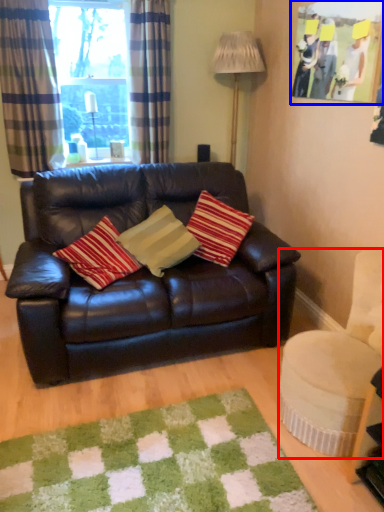
Question: Among these objects, which one is nearest to the camera, swivel chair (highlighted by a red box) or picture frame (highlighted by a blue box)?

Choices:
 (A) swivel chair
 (B) picture frame

Answer: (A)